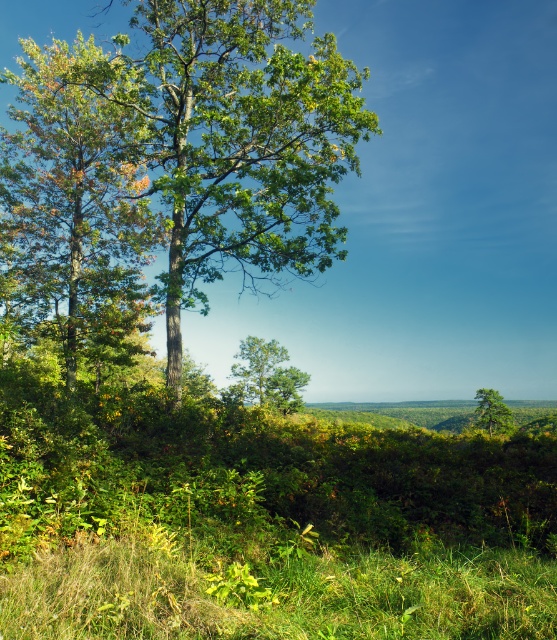
Question: Is green leafy tree at center wider than green leafy tree at left?

Choices:
 (A) yes
 (B) no

Answer: (B)

Question: Estimate the real-world distances between objects in this image. Which object is farther from the green leafy tree at center?

Choices:
 (A) green leafy tree at left
 (B) green matte tree at right

Answer: (B)

Question: Which of the following is the closest to the observer?

Choices:
 (A) (486, 422)
 (B) (285, 397)
 (C) (319, 212)
 (D) (116, 164)

Answer: (C)

Question: Does green leafy tree at left appear on the right side of green matte tree at right?

Choices:
 (A) yes
 (B) no

Answer: (B)

Question: Is green leafy tree at left further to camera compared to green matte tree at right?

Choices:
 (A) yes
 (B) no

Answer: (B)

Question: Which point is farther to the camera?

Choices:
 (A) [53, 230]
 (B) [509, 417]

Answer: (B)